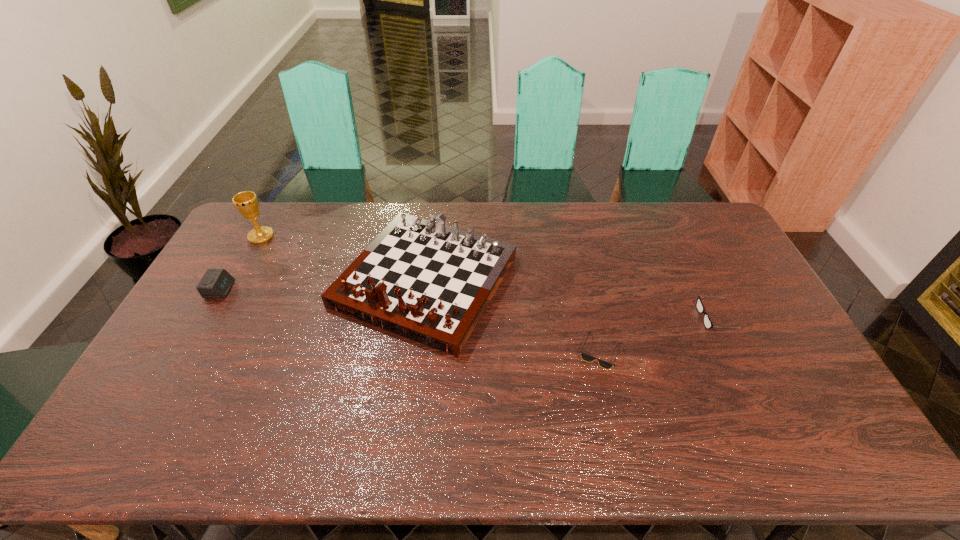
Locate an element on the screen. Image resolution: width=960 pixels, height=540 pixels. unoccupied area between the gameboard and the rightmost object is located at coordinates (571, 299).

Find the location of a particular element. free space between the fourth shortest object and the shortest object is located at coordinates (513, 316).

Locate an element on the screen. This screenshot has height=540, width=960. the second closest object to the chalice is located at coordinates (420, 279).

Identify which object is located as the fourth nearest to the rightmost object. Please provide its 2D coordinates. Your answer should be formatted as a tuple, i.e. [(x, y)], where the tuple contains the x and y coordinates of a point satisfying the conditions above.

[(216, 283)]

What are the coordinates of `free space that satisfies the following two spatial constraints: 1. on the front side of the third object from left to right; 2. on the front-facing side of the third tallest object` in the screenshot? It's located at (424, 289).

The height and width of the screenshot is (540, 960). I want to click on vacant space that satisfies the following two spatial constraints: 1. on the front side of the tallest object; 2. on the front-facing side of the alarm clock, so click(x=231, y=289).